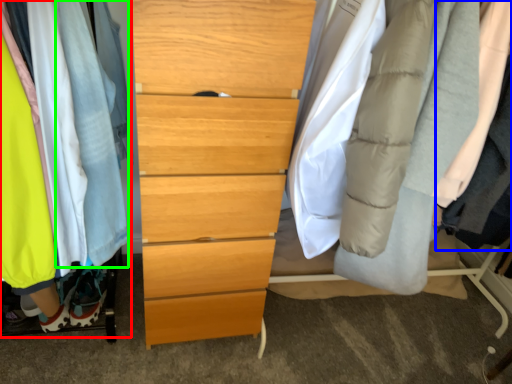
Question: Based on their relative distances, which object is farther from closet (highlighted by a red box)? Choose from robe (highlighted by a blue box) and robe (highlighted by a green box).

Choices:
 (A) robe
 (B) robe

Answer: (A)